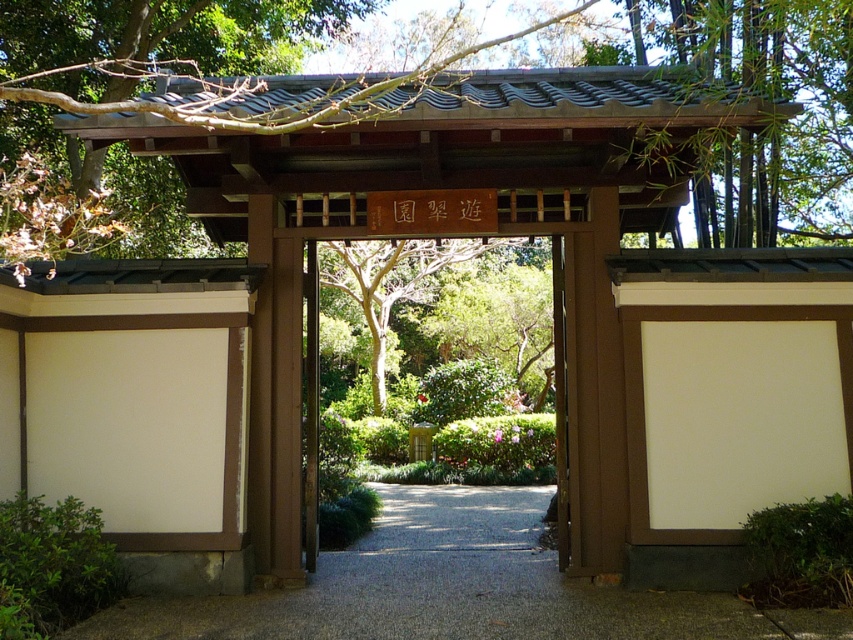
Question: Considering the relative positions of smooth gravel path at center and brown wooden gate at upper center in the image provided, where is smooth gravel path at center located with respect to brown wooden gate at upper center?

Choices:
 (A) right
 (B) left

Answer: (B)

Question: Can you confirm if smooth gravel path at center is positioned below brown wooden gate at upper center?

Choices:
 (A) yes
 (B) no

Answer: (A)

Question: Which point appears farthest from the camera in this image?

Choices:
 (A) (807, 81)
 (B) (410, 502)

Answer: (B)

Question: Which object is closer to the camera taking this photo?

Choices:
 (A) brown wooden gate at upper center
 (B) smooth gravel path at center

Answer: (B)

Question: Does smooth gravel path at center have a lesser width compared to brown wooden gate at upper center?

Choices:
 (A) no
 (B) yes

Answer: (A)